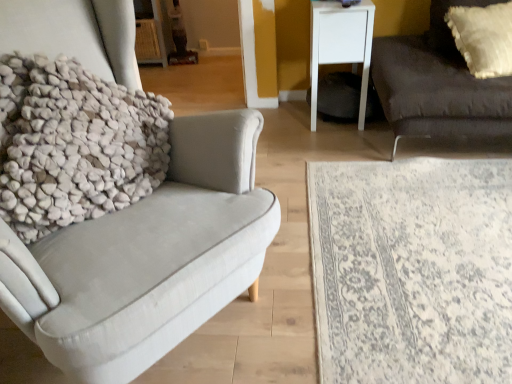
Question: From a real-world perspective, is white textured rug at lower right positioned above or below white textured pillow at left?

Choices:
 (A) above
 (B) below

Answer: (B)

Question: Considering the relative positions of white textured rug at lower right and white textured pillow at left in the image provided, is white textured rug at lower right to the left or to the right of white textured pillow at left?

Choices:
 (A) right
 (B) left

Answer: (A)

Question: Which of these objects is positioned closest to the white textured pillow at left?

Choices:
 (A) dark gray fabric couch at right
 (B) white textured rug at lower right
 (C) white textured pillow at upper right
 (D) white matte side table at upper right

Answer: (B)

Question: Which object is positioned farthest from the white matte side table at upper right?

Choices:
 (A) dark gray fabric couch at right
 (B) white textured pillow at left
 (C) white textured rug at lower right
 (D) white textured pillow at upper right

Answer: (B)